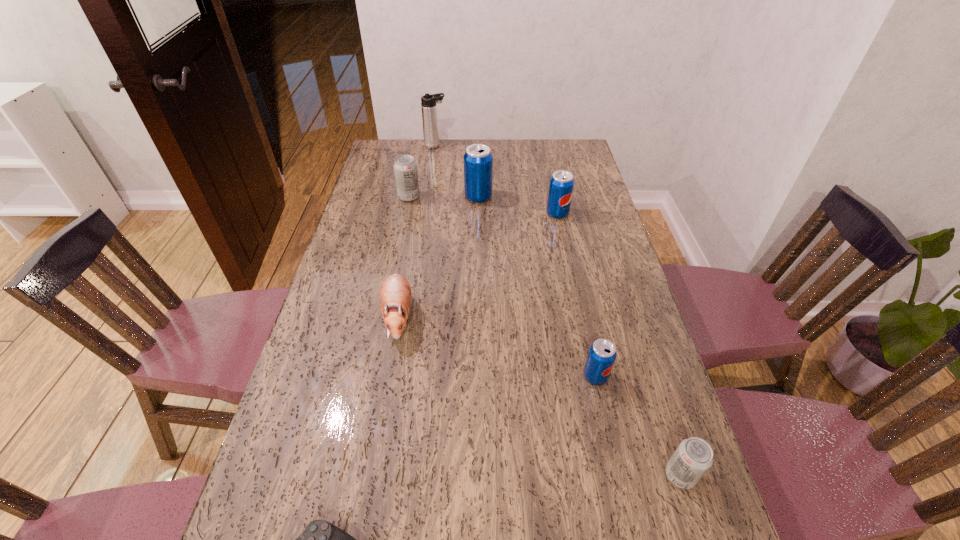
This screenshot has height=540, width=960. I want to click on the farthest object, so click(x=428, y=102).

In order to click on the tallest soda can in this screenshot , I will do `click(478, 160)`.

The width and height of the screenshot is (960, 540). Identify the location of the leftmost blue pop soda. (478, 160).

In order to click on the leftmost soda can in this screenshot , I will do `click(405, 167)`.

Locate an element on the screen. The height and width of the screenshot is (540, 960). the left gray soda can is located at coordinates (405, 167).

The width and height of the screenshot is (960, 540). I want to click on the second farthest blue pop soda, so pyautogui.click(x=561, y=185).

The height and width of the screenshot is (540, 960). I want to click on the third farthest soda can, so click(x=561, y=185).

Image resolution: width=960 pixels, height=540 pixels. Find the location of `hamster`. hamster is located at coordinates (395, 294).

Where is `the fifth farthest object`? the fifth farthest object is located at coordinates (395, 294).

This screenshot has height=540, width=960. Identify the location of the smallest blue pop soda. (602, 353).